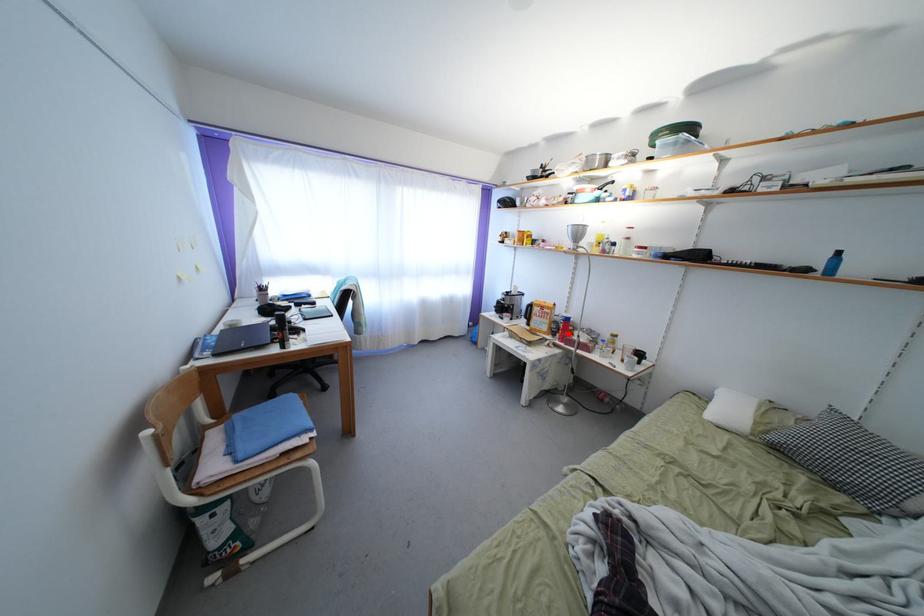
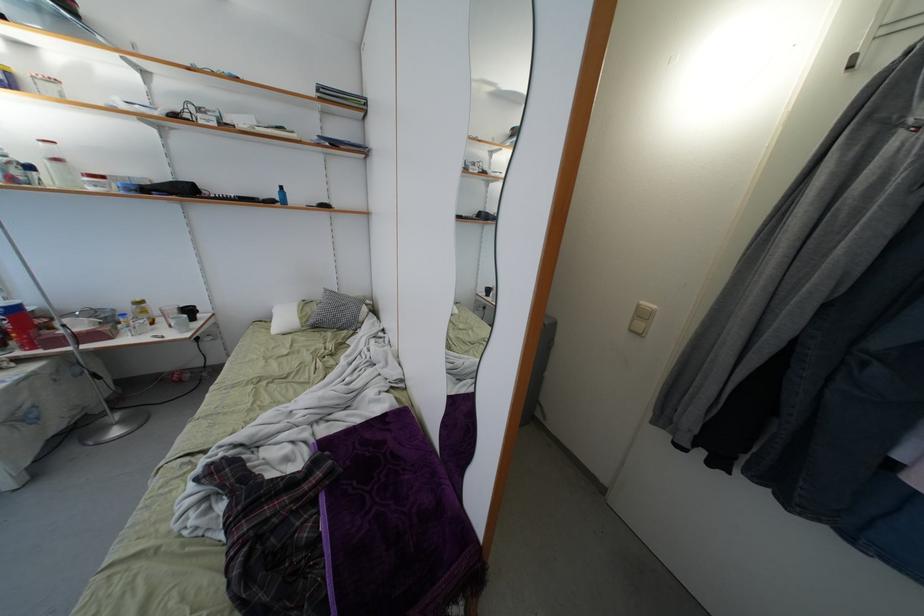
Question: I am providing you with two images of the same scene from different viewpoints. Given a red point in image1, look at the same physical point in image2. Is it:

Choices:
 (A) Closer to the viewpoint
 (B) Farther from the viewpoint

Answer: (B)